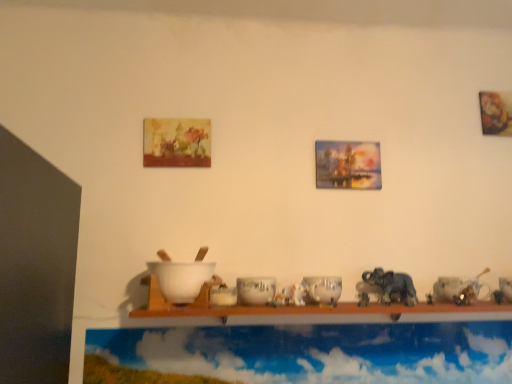
Locate an element on the screen. This screenshot has height=384, width=512. free point above cloudy sky at upper center (from a real-world perspective) is located at coordinates (318, 327).